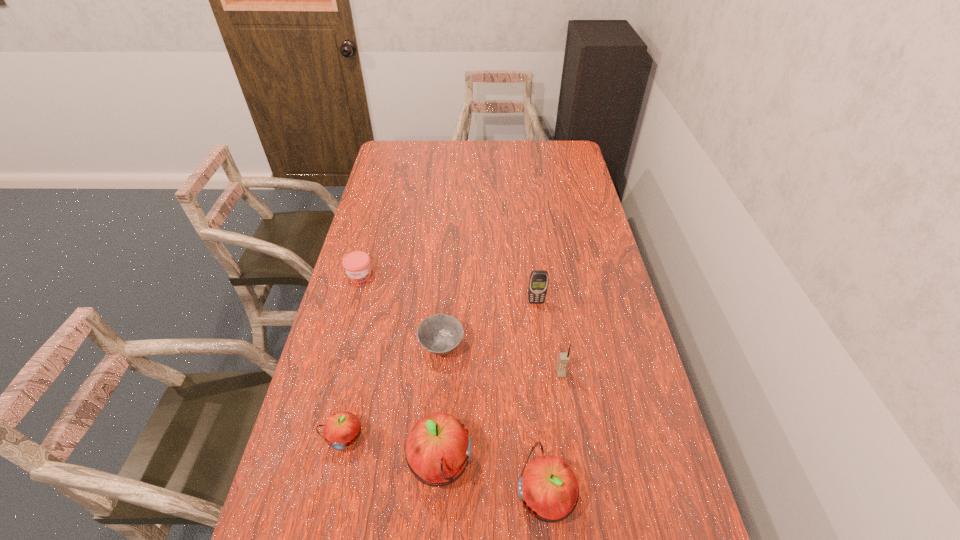
Identify the location of blank area located on the right of the shortest apple. (423, 437).

Identify the location of free space located on the right of the second apple from left to right. This screenshot has width=960, height=540. (567, 465).

Identify the location of free point located on the right of the rightmost apple. The height and width of the screenshot is (540, 960). (612, 496).

The width and height of the screenshot is (960, 540). Identify the location of free location located on the front of the right cellular telephone, where the keypad is located. (568, 425).

What are the coordinates of `free point located on the front label of the farthest object` in the screenshot? It's located at (340, 351).

At what (x,y) coordinates should I click in order to perform the action: click on free space located 0.180m on the front of the third farthest object. Please return your answer as a coordinate pair (x, y). Looking at the image, I should click on (436, 426).

Where is `vacant region located 0.080m on the screen of the sixth nearest object`? vacant region located 0.080m on the screen of the sixth nearest object is located at coordinates (539, 323).

The width and height of the screenshot is (960, 540). In order to click on apple that is at the left edge in this screenshot , I will do `click(341, 430)`.

This screenshot has height=540, width=960. Identify the location of jam situated at the left edge. (357, 264).

At what (x,y) coordinates should I click in order to perform the action: click on vacant space at the left edge of the desktop. Please return your answer as a coordinate pair (x, y). Looking at the image, I should click on (310, 483).